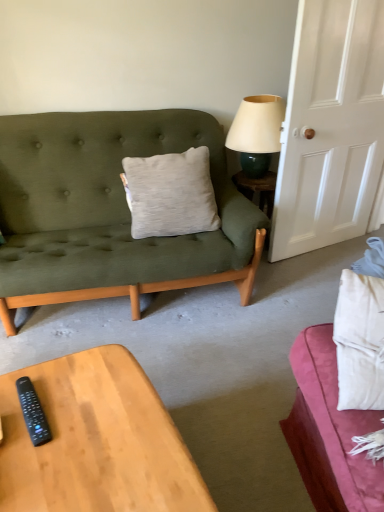
At what (x,y) coordinates should I click in order to perform the action: click on free spot to the left of black plastic remote at lower left. Please return your answer as a coordinate pair (x, y). This screenshot has height=512, width=384. Looking at the image, I should click on (10, 404).